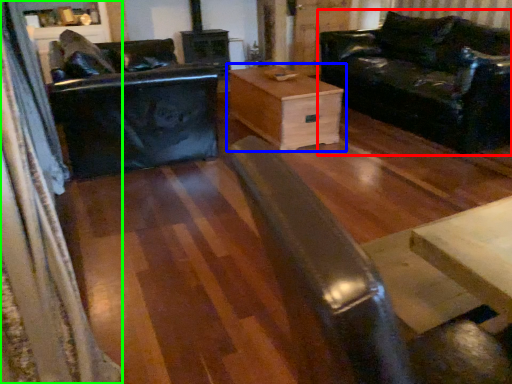
Question: Considering the real-world distances, which object is farthest from studio couch (highlighted by a red box)? table (highlighted by a blue box) or curtain (highlighted by a green box)?

Choices:
 (A) table
 (B) curtain

Answer: (B)